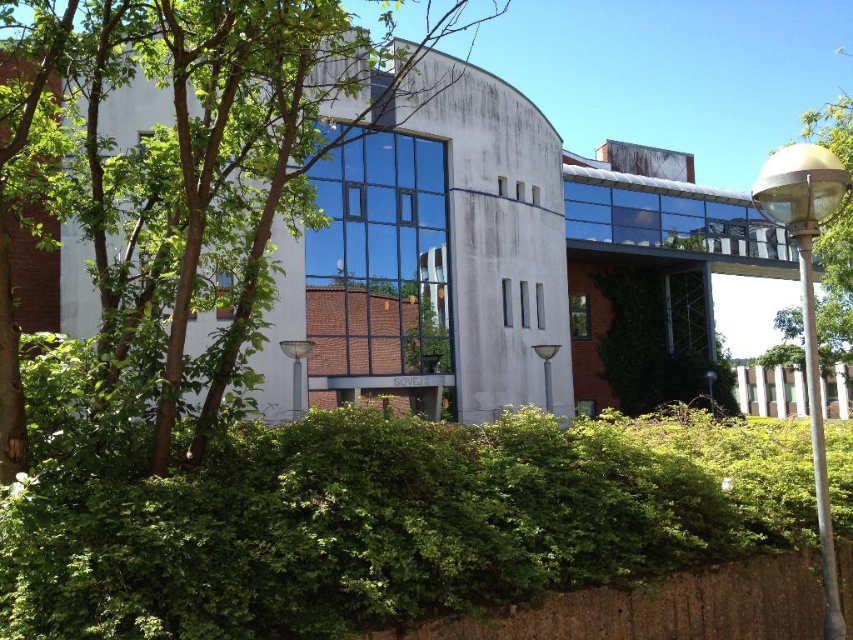
Question: Does green leafy hedge at center have a larger size compared to green leafy tree at center?

Choices:
 (A) yes
 (B) no

Answer: (B)

Question: Is green leafy hedge at center smaller than green leafy tree at center?

Choices:
 (A) no
 (B) yes

Answer: (B)

Question: Does green leafy hedge at center appear under green leafy tree at center?

Choices:
 (A) yes
 (B) no

Answer: (A)

Question: Which object is farther from the camera taking this photo?

Choices:
 (A) green leafy tree at center
 (B) green leafy hedge at center

Answer: (A)

Question: Which of the following is the closest to the observer?

Choices:
 (A) click(x=260, y=596)
 (B) click(x=376, y=100)

Answer: (A)